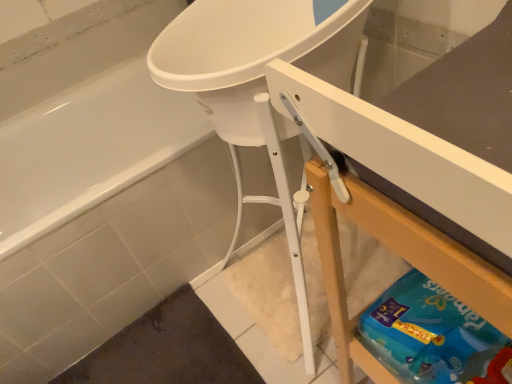
Question: Would you say white glossy bathtub at upper left is to the left or to the right of blue cardboard box at lower right in the picture?

Choices:
 (A) left
 (B) right

Answer: (A)

Question: Is point (211, 142) closer or farther from the camera than point (316, 215)?

Choices:
 (A) closer
 (B) farther

Answer: (B)

Question: Is white glossy bathtub at upper left inside the boundaries of blue cardboard box at lower right, or outside?

Choices:
 (A) inside
 (B) outside

Answer: (B)

Question: From the image's perspective, relative to white glossy bathtub at upper left, is blue cardboard box at lower right above or below?

Choices:
 (A) below
 (B) above

Answer: (A)

Question: In terms of width, does blue cardboard box at lower right look wider or thinner when compared to white glossy bathtub at upper left?

Choices:
 (A) thin
 (B) wide

Answer: (A)

Question: From a real-world perspective, is blue cardboard box at lower right physically located above or below white glossy bathtub at upper left?

Choices:
 (A) below
 (B) above

Answer: (B)

Question: Considering their positions, is blue cardboard box at lower right located in front of or behind white glossy bathtub at upper left?

Choices:
 (A) behind
 (B) front

Answer: (B)